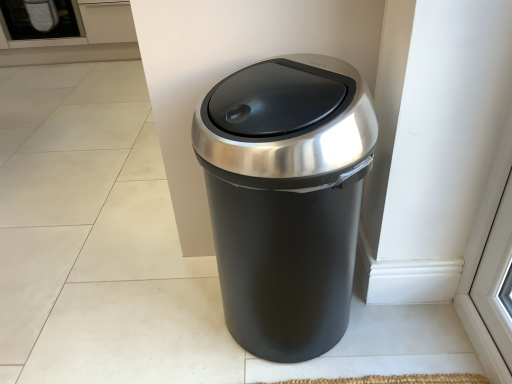
Question: From a real-world perspective, is white frosted glass screen door at upper left positioned above or below black matte trash can at center?

Choices:
 (A) below
 (B) above

Answer: (B)

Question: Based on their sizes in the image, would you say white frosted glass screen door at upper left is bigger or smaller than black matte trash can at center?

Choices:
 (A) small
 (B) big

Answer: (B)

Question: In terms of width, does white frosted glass screen door at upper left look wider or thinner when compared to black matte trash can at center?

Choices:
 (A) thin
 (B) wide

Answer: (B)

Question: Would you say black matte trash can at center is to the left or to the right of white frosted glass screen door at upper left in the picture?

Choices:
 (A) right
 (B) left

Answer: (A)

Question: Is black matte trash can at center situated inside white frosted glass screen door at upper left or outside?

Choices:
 (A) inside
 (B) outside

Answer: (B)

Question: Considering the positions of black matte trash can at center and white frosted glass screen door at upper left in the image, is black matte trash can at center bigger or smaller than white frosted glass screen door at upper left?

Choices:
 (A) big
 (B) small

Answer: (B)

Question: Considering the positions of black matte trash can at center and white frosted glass screen door at upper left in the image, is black matte trash can at center wider or thinner than white frosted glass screen door at upper left?

Choices:
 (A) wide
 (B) thin

Answer: (B)